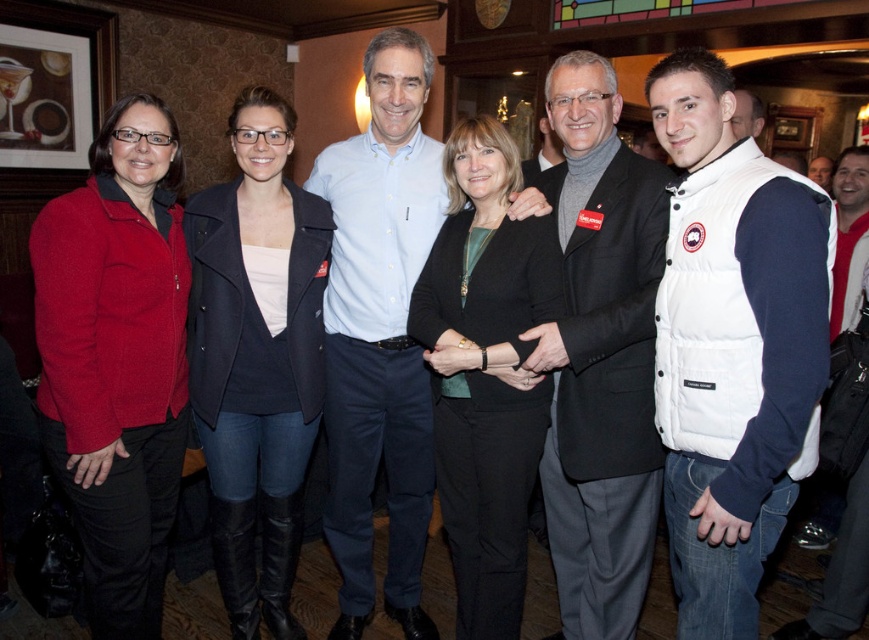
Question: Which of the following is the closest to the observer?

Choices:
 (A) (808, 376)
 (B) (275, 465)

Answer: (A)

Question: Which point appears farthest from the camera in this image?

Choices:
 (A) (130, 243)
 (B) (818, 392)
 (C) (568, 385)

Answer: (C)

Question: Is white down vest at center thinner than light blue button-down shirt at center?

Choices:
 (A) yes
 (B) no

Answer: (A)

Question: Which of these objects is positioned closest to the matte black jacket at center?

Choices:
 (A) black matte blazer at center
 (B) white down vest at center
 (C) light blue button-down shirt at center
 (D) dark gray wool suit at center

Answer: (C)

Question: Does matte black jacket at center have a larger size compared to black matte blazer at center?

Choices:
 (A) yes
 (B) no

Answer: (A)

Question: Can you confirm if matte red jacket at left is bigger than dark gray wool suit at center?

Choices:
 (A) no
 (B) yes

Answer: (A)